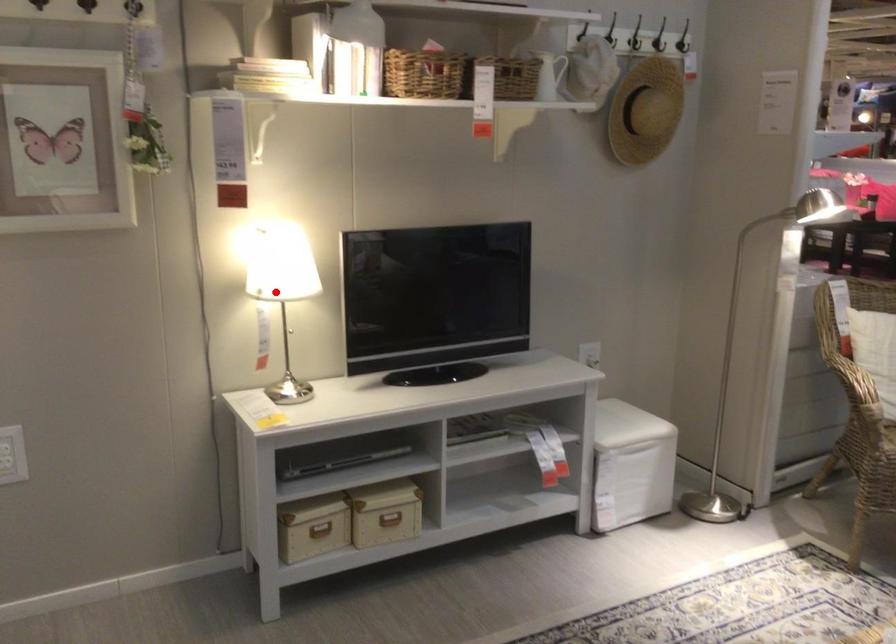
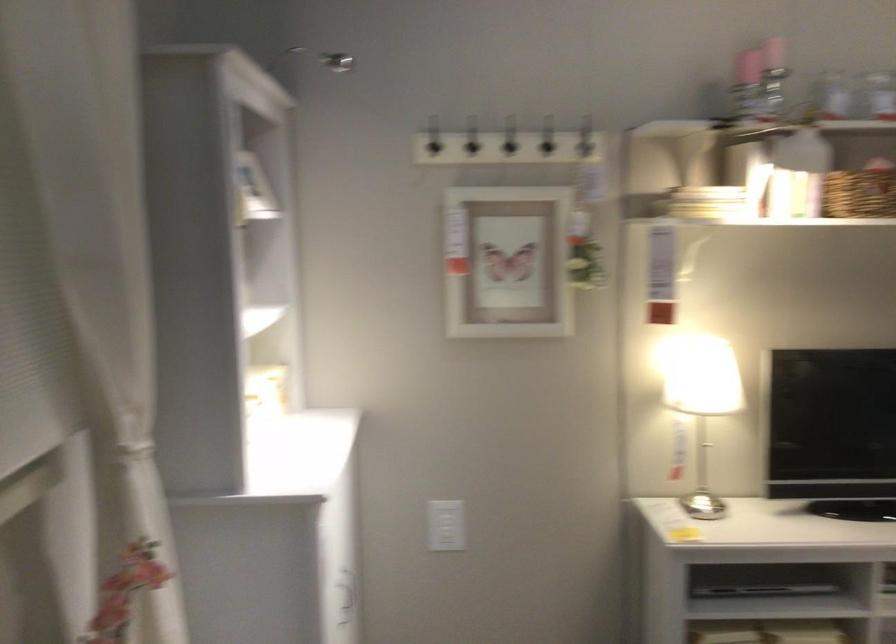
The point at the highlighted location is marked in the first image. Where is the corresponding point in the second image?

(702, 402)